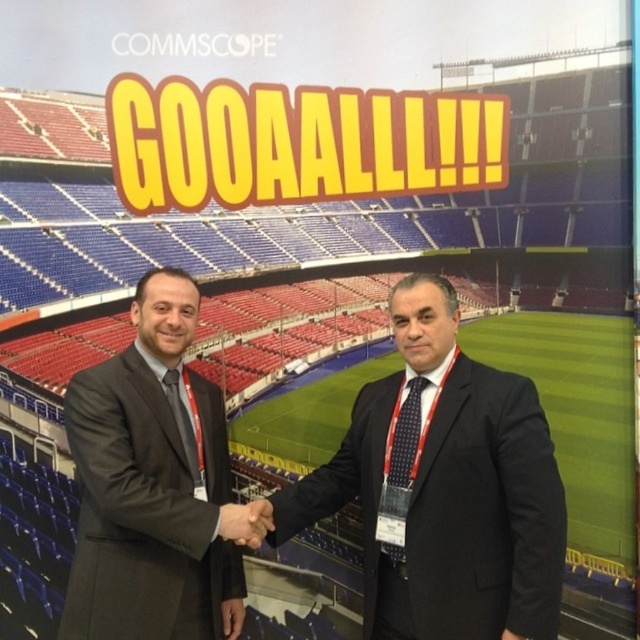
You are organizing a photo shoot and need to position two models wearing the dark suit at center and dark gray suit at center so that they are exactly 10 meters apart. Based on the current setup, can you achieve this without moving the backdrop?

The dark suit at center and dark gray suit at center are currently 12.48 meters apart. To reduce the distance to 10 meters, you can move them closer by 2.48 meters while keeping the backdrop in place.

You are a photographer at the event and need to capture a clear photo of the dark suit at center without the smooth skin handshake at center blocking it. How should you adjust your camera angle?

Since the dark suit at center is in front of the smooth skin handshake at center, you can move your camera position slightly to the side or adjust the angle to frame the dark suit at center while excluding the smooth skin handshake at center from the shot.

You are organizing a photo shoot and need to ensure that the two individuals in the image can stand side by side without overlapping. Given that the dark suit at center and dark gray suit at center must both be visible in the frame, which person should be positioned to the side to accommodate their sizes?

The dark suit at center is wider than the dark gray suit at center, so positioning the person in the dark gray suit at center closer to the edge would allow both to fit without overlapping.